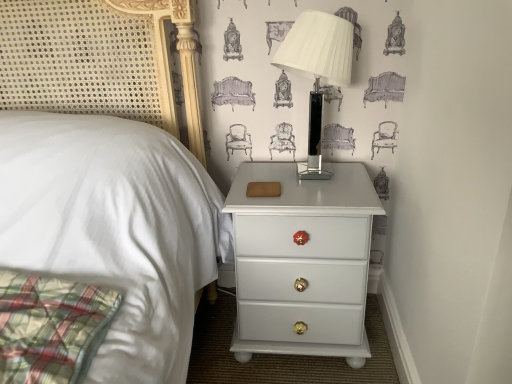
Find the location of a particular element. vacant space that is to the left of white glossy table lamp at upper right is located at coordinates (256, 178).